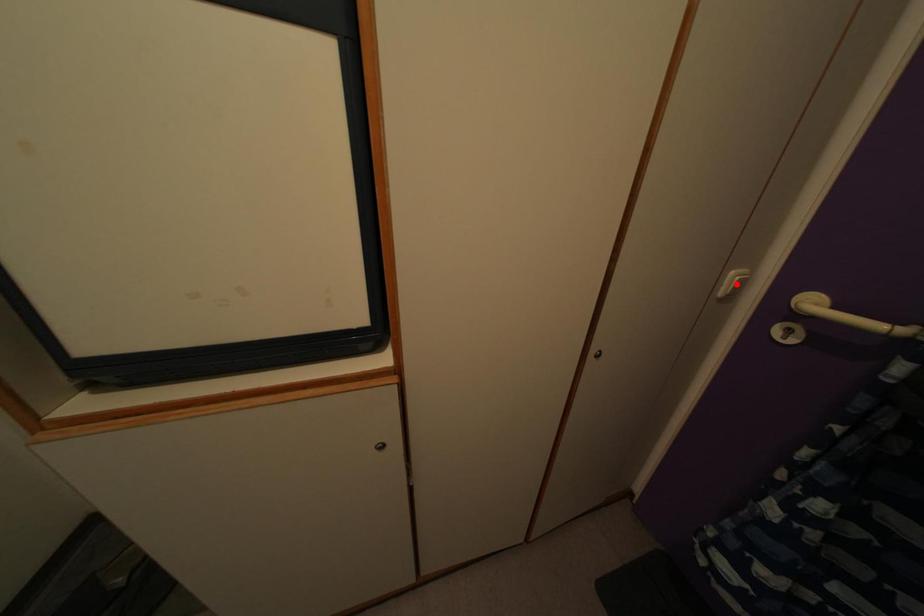
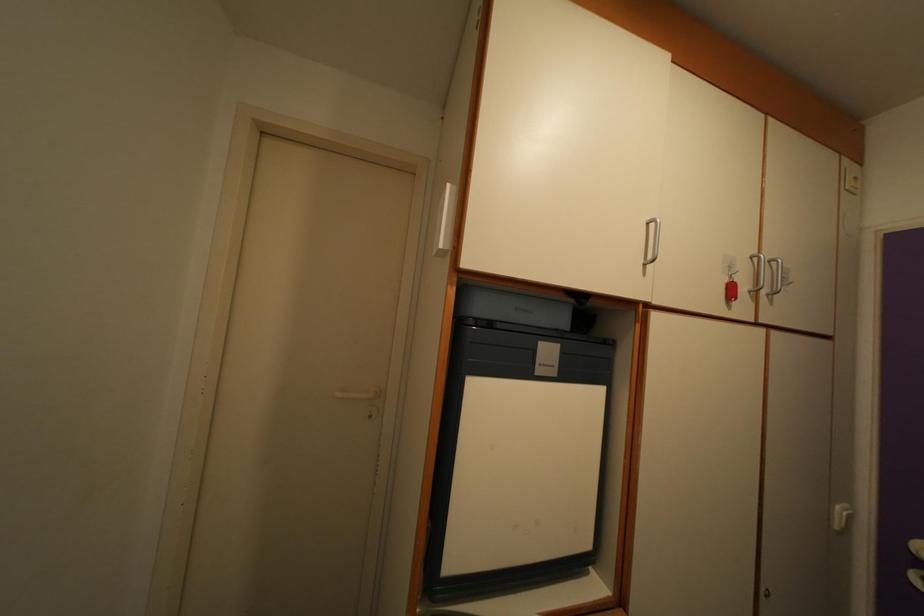
Where in the second image is the point corresponding to the highlighted location from the first image?

(843, 519)